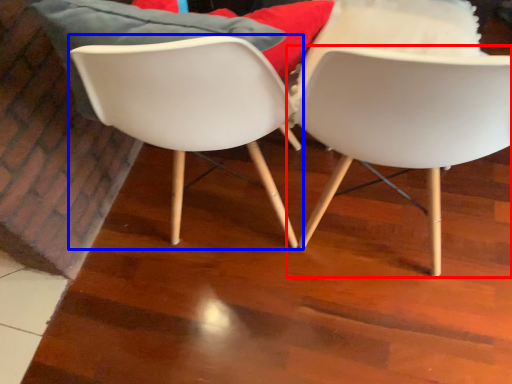
Question: Which object appears closest to the camera in this image, chair (highlighted by a red box) or chair (highlighted by a blue box)?

Choices:
 (A) chair
 (B) chair

Answer: (A)